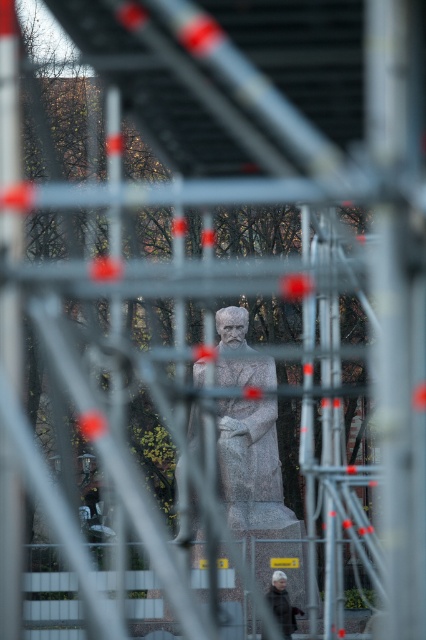
Who is taller, granite statue at center or gray woolen coat at lower center?

Standing taller between the two is gray woolen coat at lower center.

Can you confirm if granite statue at center is thinner than gray woolen coat at lower center?

Yes, granite statue at center is thinner than gray woolen coat at lower center.

Is point (176, 477) positioned before point (284, 616)?

No.

I want to click on granite statue at center, so click(x=250, y=465).